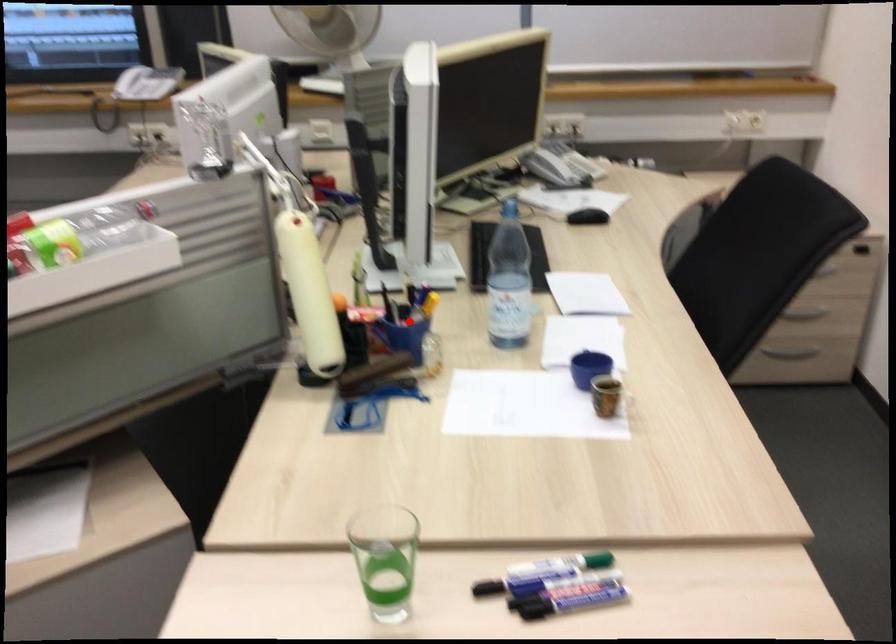
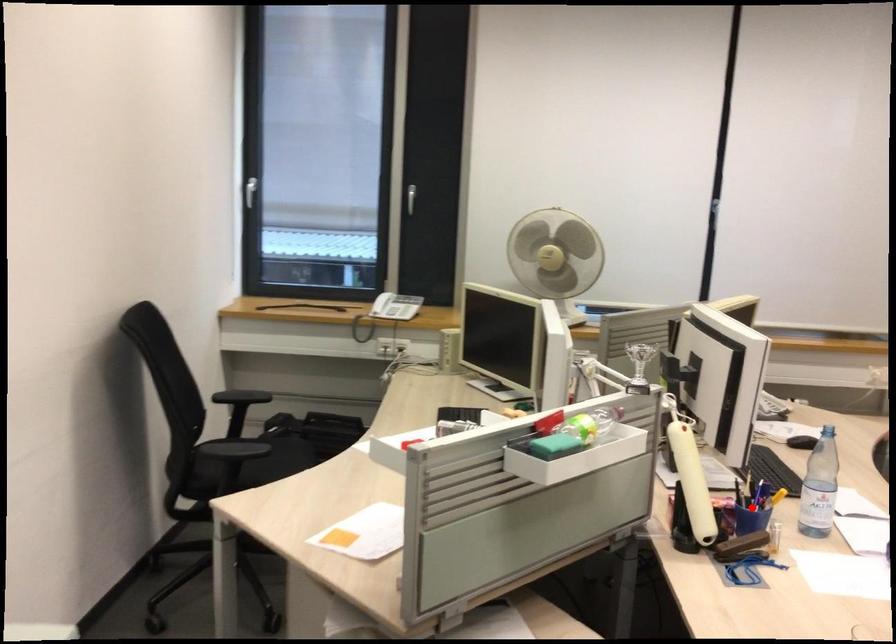
I am providing you with two images of the same scene from different viewpoints. A red point is marked on the first image and another point is marked on the second image. Is the red point in image1 aligned with the point shown in image2?

Yes